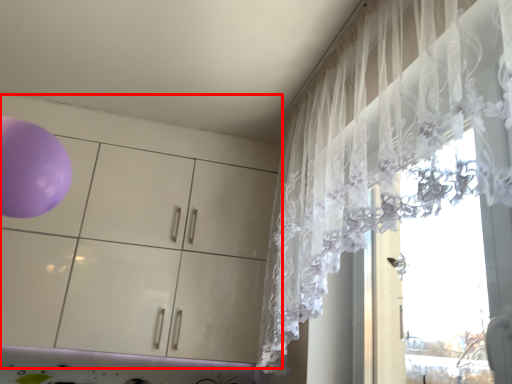
Question: Where is dresser (annotated by the red box) located in relation to curtain in the image?

Choices:
 (A) left
 (B) right

Answer: (A)